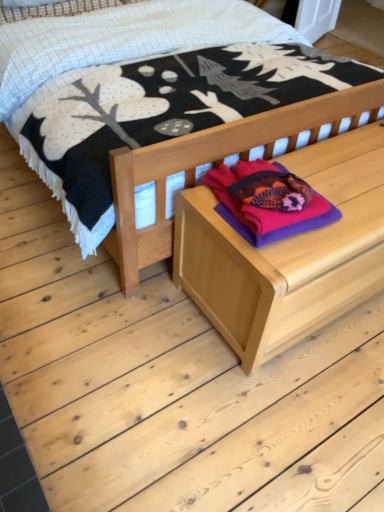
What do you see at coordinates (267, 201) in the screenshot? The width and height of the screenshot is (384, 512). I see `purple fleece sweater at center` at bounding box center [267, 201].

Measure the distance between wooden chest at center and camera.

A distance of 1.11 meters exists between wooden chest at center and camera.

Describe the element at coordinates (289, 253) in the screenshot. I see `wooden chest at center` at that location.

This screenshot has height=512, width=384. I want to click on purple fleece sweater at center, so click(267, 201).

Visually, is wooden chest at center positioned to the left or to the right of natural wood bed at center?

wooden chest at center is to the right of natural wood bed at center.

What's the angular difference between wooden chest at center and natural wood bed at center's facing directions?

The angle between the facing direction of wooden chest at center and the facing direction of natural wood bed at center is 0.337 degrees.

Is point (268, 293) farther from viewer compared to point (115, 24)?

No.

Looking at this image, from the image's perspective, would you say wooden chest at center is positioned over natural wood bed at center?

Actually, wooden chest at center appears below natural wood bed at center in the image.

Is natural wood bed at center surrounded by purple fleece sweater at center?

No, natural wood bed at center is located outside of purple fleece sweater at center.

Which is in front, point (233, 219) or point (193, 143)?

The point (233, 219) is closer.

Considering the sizes of objects purple fleece sweater at center and natural wood bed at center in the image provided, who is taller, purple fleece sweater at center or natural wood bed at center?

Standing taller between the two is natural wood bed at center.

Can you confirm if purple fleece sweater at center is smaller than natural wood bed at center?

Indeed, purple fleece sweater at center has a smaller size compared to natural wood bed at center.

Are natural wood bed at center and wooden chest at center far apart?

natural wood bed at center is actually quite close to wooden chest at center.

What's the angular difference between natural wood bed at center and wooden chest at center's facing directions?

There is a 0.337-degree angle between the facing directions of natural wood bed at center and wooden chest at center.

From a real-world perspective, relative to wooden chest at center, is natural wood bed at center vertically above or below?

From a real-world perspective, natural wood bed at center is physically above wooden chest at center.

Is natural wood bed at center oriented away from wooden chest at center?

No.

Based on their sizes in the image, would you say wooden chest at center is bigger or smaller than purple fleece sweater at center?

Clearly, wooden chest at center is larger in size than purple fleece sweater at center.

Is wooden chest at center not near purple fleece sweater at center?

wooden chest at center is near purple fleece sweater at center, not far away.

From a real-world perspective, is wooden chest at center on purple fleece sweater at center?

No, from a real-world perspective, wooden chest at center is not above purple fleece sweater at center.

Is point (176, 267) behind point (282, 175)?

Yes, point (176, 267) is farther from viewer.

Can you confirm if purple fleece sweater at center is bigger than wooden chest at center?

Incorrect, purple fleece sweater at center is not larger than wooden chest at center.

Between purple fleece sweater at center and wooden chest at center, which one appears on the left side from the viewer's perspective?

purple fleece sweater at center.

Who is more distant, purple fleece sweater at center or wooden chest at center?

purple fleece sweater at center is behind.

Is natural wood bed at center positioned beyond the bounds of purple fleece sweater at center?

Yes, natural wood bed at center is not within purple fleece sweater at center.

How different are the orientations of natural wood bed at center and purple fleece sweater at center in degrees?

3.64 degrees.

In terms of width, does natural wood bed at center look wider or thinner when compared to purple fleece sweater at center?

In the image, natural wood bed at center appears to be wider than purple fleece sweater at center.

Locate an element on the screen. This screenshot has width=384, height=512. table on the right side of natural wood bed at center is located at coordinates (289, 253).

Identify the location of clothing that is below the natural wood bed at center (from the image's perspective). (267, 201).

Looking at the image, which one is located further to wooden chest at center, natural wood bed at center or purple fleece sweater at center?

natural wood bed at center is further to wooden chest at center.

Considering their positions, is purple fleece sweater at center positioned closer to natural wood bed at center than wooden chest at center?

wooden chest at center is positioned closer to the anchor natural wood bed at center.

Estimate the real-world distances between objects in this image. Which object is closer to purple fleece sweater at center, natural wood bed at center or wooden chest at center?

Among the two, wooden chest at center is located nearer to purple fleece sweater at center.

Estimate the real-world distances between objects in this image. Which object is closer to wooden chest at center, purple fleece sweater at center or natural wood bed at center?

purple fleece sweater at center is closer to wooden chest at center.

Which object lies further to the anchor point purple fleece sweater at center, wooden chest at center or natural wood bed at center?

The object further to purple fleece sweater at center is natural wood bed at center.

When comparing their distances from natural wood bed at center, does wooden chest at center or purple fleece sweater at center seem closer?

wooden chest at center is positioned closer to the anchor natural wood bed at center.

At what (x,y) coordinates should I click in order to perform the action: click on clothing between natural wood bed at center and wooden chest at center from top to bottom. Please return your answer as a coordinate pair (x, y). The width and height of the screenshot is (384, 512). Looking at the image, I should click on (267, 201).